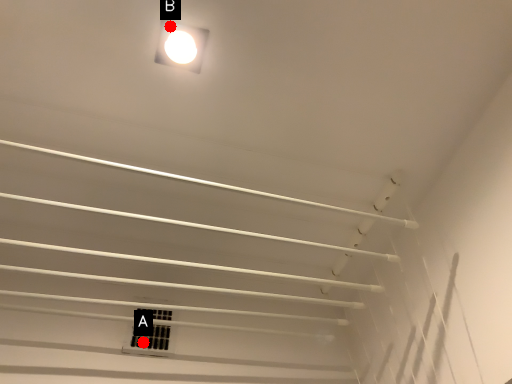
Question: Two points are circled on the image, labeled by A and B beside each circle. Which point is closer to the camera?

Choices:
 (A) A is closer
 (B) B is closer

Answer: (B)